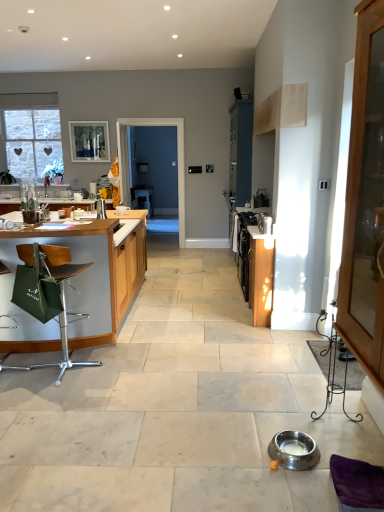
Question: Would you say green fabric table at left contains transparent glass screen door at center?

Choices:
 (A) no
 (B) yes

Answer: (A)

Question: From the image's perspective, does green fabric table at left appear lower than transparent glass screen door at center?

Choices:
 (A) no
 (B) yes

Answer: (B)

Question: Is green fabric table at left positioned behind transparent glass screen door at center?

Choices:
 (A) no
 (B) yes

Answer: (A)

Question: Are green fabric table at left and transparent glass screen door at center far apart?

Choices:
 (A) yes
 (B) no

Answer: (A)

Question: From a real-world perspective, is green fabric table at left on transparent glass screen door at center?

Choices:
 (A) no
 (B) yes

Answer: (A)

Question: From the image's perspective, is green fabric table at left positioned above or below transparent glass screen door at center?

Choices:
 (A) below
 (B) above

Answer: (A)

Question: From a real-world perspective, is green fabric table at left positioned above or below transparent glass screen door at center?

Choices:
 (A) above
 (B) below

Answer: (B)

Question: Is green fabric table at left situated inside transparent glass screen door at center or outside?

Choices:
 (A) inside
 (B) outside

Answer: (B)

Question: Is green fabric table at left wider or thinner than transparent glass screen door at center?

Choices:
 (A) thin
 (B) wide

Answer: (B)

Question: Is purple fabric swivel chair at lower right taller or shorter than satin silver kettle at center-right, the first appliance when ordered from back to front?

Choices:
 (A) short
 (B) tall

Answer: (A)

Question: From a real-world perspective, is purple fabric swivel chair at lower right above or below satin silver kettle at center-right, the first appliance when ordered from back to front?

Choices:
 (A) below
 (B) above

Answer: (A)

Question: Is purple fabric swivel chair at lower right bigger or smaller than satin silver kettle at center-right, marked as the second appliance in a bottom-to-top arrangement?

Choices:
 (A) small
 (B) big

Answer: (B)

Question: Considering their positions, is purple fabric swivel chair at lower right located in front of or behind satin silver kettle at center-right, positioned as the 1th appliance in top-to-bottom order?

Choices:
 (A) behind
 (B) front

Answer: (B)

Question: Relative to matte glass window screen at upper left, is purple fabric swivel chair at lower right in front or behind?

Choices:
 (A) behind
 (B) front

Answer: (B)

Question: Would you say purple fabric swivel chair at lower right is to the left or to the right of matte glass window screen at upper left in the picture?

Choices:
 (A) left
 (B) right

Answer: (B)